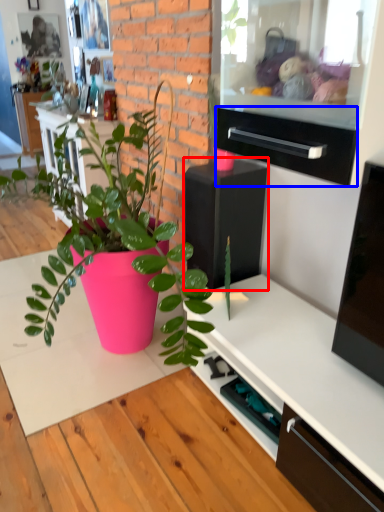
Question: Which of the following is the closest to the observer, appliance (highlighted by a red box) or drawer (highlighted by a blue box)?

Choices:
 (A) appliance
 (B) drawer

Answer: (B)